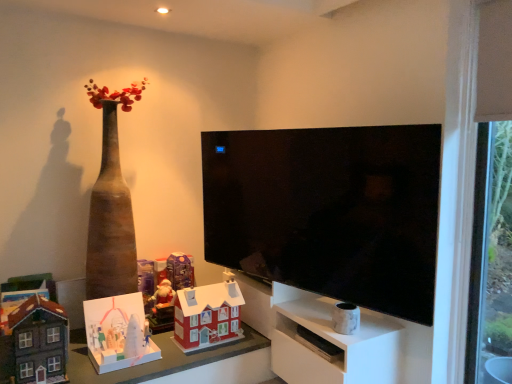
The width and height of the screenshot is (512, 384). I want to click on vacant space underneath white cardboard house at lower left, marked as the 4th toy in a right-to-left arrangement (from a real-world perspective), so coord(124,356).